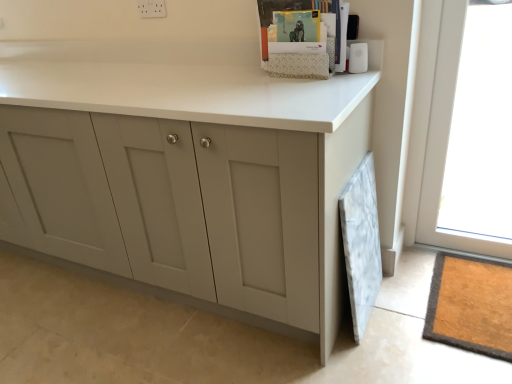
Question: From a real-world perspective, is matte gray cabinet at center positioned over transparent glass window at upper right based on gravity?

Choices:
 (A) no
 (B) yes

Answer: (A)

Question: From the image's perspective, is matte gray cabinet at center above transparent glass window at upper right?

Choices:
 (A) yes
 (B) no

Answer: (B)

Question: From the image's perspective, is matte gray cabinet at center located beneath transparent glass window at upper right?

Choices:
 (A) yes
 (B) no

Answer: (A)

Question: Is matte gray cabinet at center positioned in front of transparent glass window at upper right?

Choices:
 (A) no
 (B) yes

Answer: (B)

Question: Is transparent glass window at upper right inside matte gray cabinet at center?

Choices:
 (A) yes
 (B) no

Answer: (B)

Question: Is matte gray cabinet at center oriented towards transparent glass window at upper right?

Choices:
 (A) yes
 (B) no

Answer: (B)

Question: Is matte gray cabinet at center inside transparent glass window at upper right?

Choices:
 (A) no
 (B) yes

Answer: (A)

Question: Is the depth of transparent glass window at upper right less than that of matte gray cabinet at center?

Choices:
 (A) no
 (B) yes

Answer: (A)

Question: Can you confirm if transparent glass window at upper right is bigger than matte gray cabinet at center?

Choices:
 (A) no
 (B) yes

Answer: (A)

Question: From the image's perspective, is transparent glass window at upper right under matte gray cabinet at center?

Choices:
 (A) no
 (B) yes

Answer: (A)

Question: Considering the relative sizes of transparent glass window at upper right and matte gray cabinet at center in the image provided, is transparent glass window at upper right taller than matte gray cabinet at center?

Choices:
 (A) no
 (B) yes

Answer: (B)

Question: Is transparent glass window at upper right at the right side of matte gray cabinet at center?

Choices:
 (A) no
 (B) yes

Answer: (B)

Question: Is matte gray cabinet at center taller or shorter than transparent glass window at upper right?

Choices:
 (A) tall
 (B) short

Answer: (B)